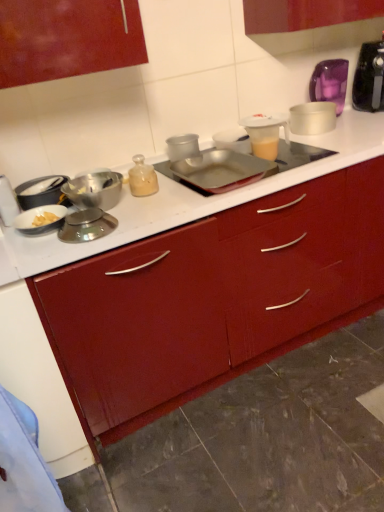
Question: Does matte silver bowl at left, which ranks as the second kitchen appliance in left-to-right order, appear on the left side of shiny silver bowl at left, marked as the 4th kitchen appliance in a left-to-right arrangement?

Choices:
 (A) no
 (B) yes

Answer: (B)

Question: From a real-world perspective, is matte silver bowl at left, acting as the sixth kitchen appliance starting from the right, positioned over shiny silver bowl at left, marked as the 4th kitchen appliance in a left-to-right arrangement, based on gravity?

Choices:
 (A) yes
 (B) no

Answer: (B)

Question: Is matte silver bowl at left, acting as the sixth kitchen appliance starting from the right, turned away from shiny silver bowl at left, marked as the 4th kitchen appliance in a left-to-right arrangement?

Choices:
 (A) yes
 (B) no

Answer: (B)

Question: From the image's perspective, is matte silver bowl at left, which ranks as the second kitchen appliance in left-to-right order, beneath shiny silver bowl at left, marked as the 4th kitchen appliance in a left-to-right arrangement?

Choices:
 (A) yes
 (B) no

Answer: (B)

Question: Is matte silver bowl at left, which ranks as the second kitchen appliance in left-to-right order, shorter than shiny silver bowl at left, the fourth kitchen appliance when ordered from right to left?

Choices:
 (A) no
 (B) yes

Answer: (B)

Question: Is translucent glass bottle at center inside or outside of shiny silver bowl at left, the fourth kitchen appliance when ordered from right to left?

Choices:
 (A) outside
 (B) inside

Answer: (A)

Question: Based on their sizes in the image, would you say translucent glass bottle at center is bigger or smaller than shiny silver bowl at left, marked as the 4th kitchen appliance in a left-to-right arrangement?

Choices:
 (A) big
 (B) small

Answer: (B)

Question: Considering the positions of translucent glass bottle at center and shiny silver bowl at left, marked as the 4th kitchen appliance in a left-to-right arrangement, in the image, is translucent glass bottle at center wider or thinner than shiny silver bowl at left, marked as the 4th kitchen appliance in a left-to-right arrangement,?

Choices:
 (A) wide
 (B) thin

Answer: (B)

Question: Is translucent glass bottle at center taller or shorter than shiny silver bowl at left, marked as the 4th kitchen appliance in a left-to-right arrangement?

Choices:
 (A) short
 (B) tall

Answer: (B)

Question: Considering their positions, is translucent glass bottle at center located in front of or behind translucent plastic mixer at upper right?

Choices:
 (A) behind
 (B) front

Answer: (B)

Question: From the image's perspective, relative to translucent plastic mixer at upper right, is translucent glass bottle at center above or below?

Choices:
 (A) above
 (B) below

Answer: (B)

Question: Considering the positions of point (130, 189) and point (375, 106), is point (130, 189) closer or farther from the camera than point (375, 106)?

Choices:
 (A) farther
 (B) closer

Answer: (B)

Question: From a real-world perspective, is translucent glass bottle at center above or below translucent plastic mixer at upper right?

Choices:
 (A) below
 (B) above

Answer: (A)

Question: From a real-world perspective, is metallic silver tray at center, placed as the sixth kitchen appliance when sorted from left to right, physically located above or below translucent glass bottle at center?

Choices:
 (A) above
 (B) below

Answer: (B)

Question: From their relative heights in the image, would you say metallic silver tray at center, the 2th kitchen appliance in the right-to-left sequence, is taller or shorter than translucent glass bottle at center?

Choices:
 (A) short
 (B) tall

Answer: (A)